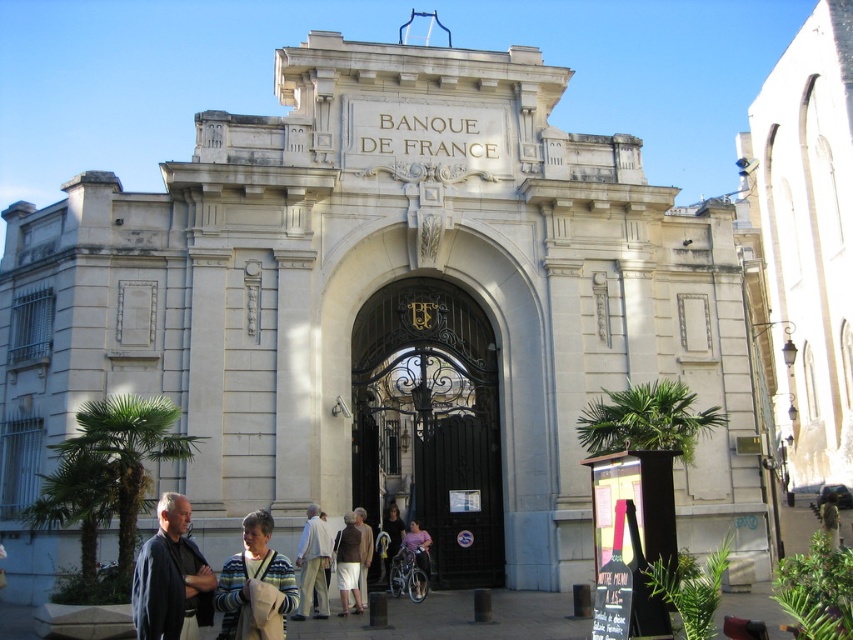
You are standing in front of the Banque de France entrance and see a striped sweater at center. Where is the striped sweater located in relation to the main entrance?

The striped sweater at center is located at point (254, 582), which is near the center of the image, directly in front of the main entrance.

You are a visitor approaching the entrance of the Banque de France. You see the dark wrought iron gate at center and the dark blue jacket at lower left. Which object is positioned higher from the ground?

The dark wrought iron gate at center is located above the dark blue jacket at lower left, so the dark wrought iron gate at center is positioned higher from the ground.